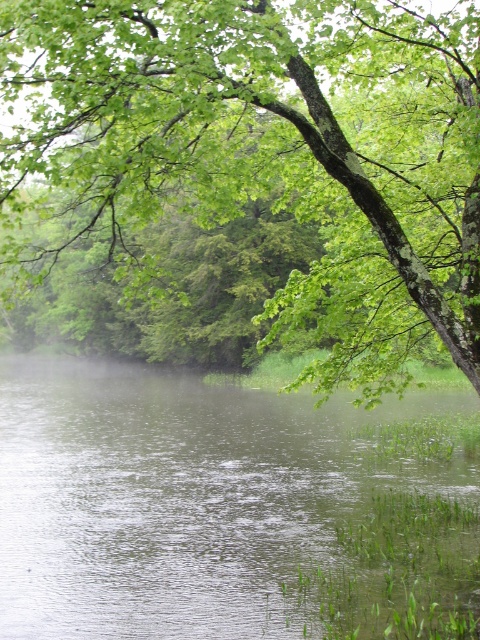
Question: Can you confirm if green leafy tree at upper center is positioned below clear water at center?

Choices:
 (A) no
 (B) yes

Answer: (A)

Question: Can you confirm if green leafy tree at upper center is positioned to the left of clear water at center?

Choices:
 (A) yes
 (B) no

Answer: (B)

Question: Does green leafy tree at upper center lie in front of clear water at center?

Choices:
 (A) no
 (B) yes

Answer: (B)

Question: Which point is farther to the camera?

Choices:
 (A) (208, 104)
 (B) (154, 596)

Answer: (B)